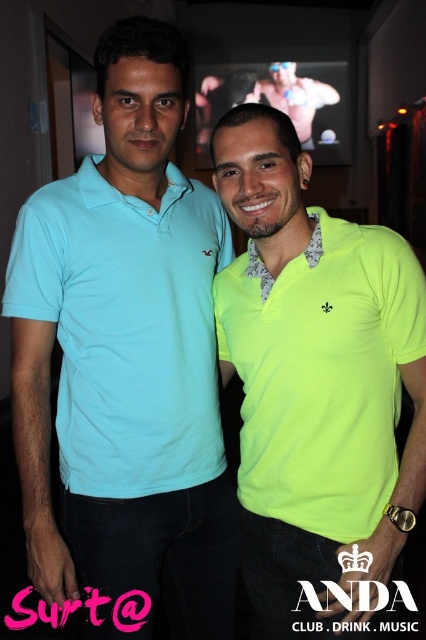
Question: Among these objects, which one is nearest to the camera?

Choices:
 (A) neon yellow polo shirt at center
 (B) muscular skin at upper center
 (C) matte light blue polo shirt at left

Answer: (A)

Question: Is matte light blue polo shirt at left above muscular skin at upper center?

Choices:
 (A) yes
 (B) no

Answer: (B)

Question: Is matte light blue polo shirt at left thinner than neon yellow polo shirt at center?

Choices:
 (A) no
 (B) yes

Answer: (A)

Question: Which point is farther from the camera taking this photo?

Choices:
 (A) (423, 336)
 (B) (261, 77)
 (C) (51, 253)

Answer: (B)

Question: Is matte light blue polo shirt at left smaller than muscular skin at upper center?

Choices:
 (A) yes
 (B) no

Answer: (A)

Question: Among these points, which one is farthest from the camera?

Choices:
 (A) (279, 93)
 (B) (244, 467)

Answer: (A)